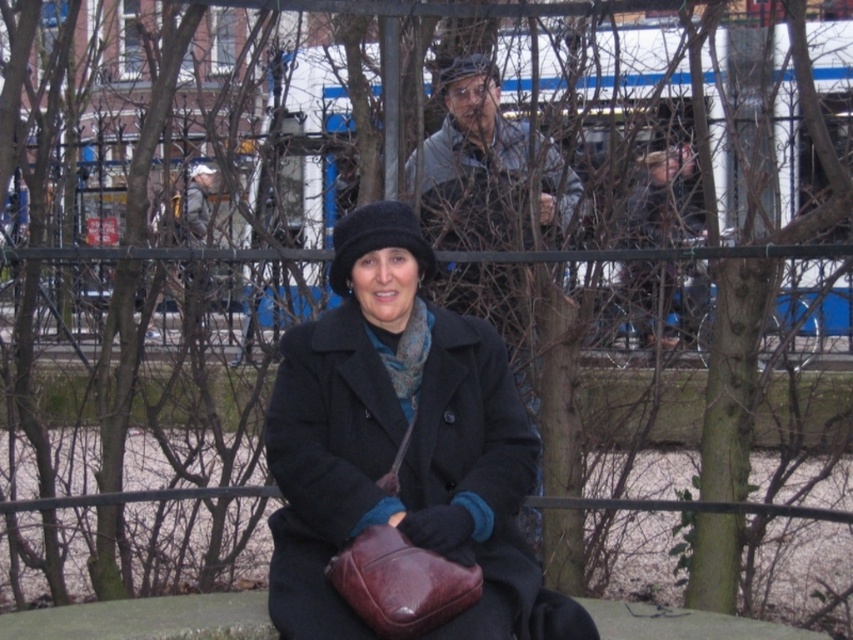
Can you confirm if matte black coat at center is thinner than gray woolen jacket at upper center?

No, matte black coat at center is not thinner than gray woolen jacket at upper center.

Does matte black coat at center appear under gray woolen jacket at upper center?

Yes, matte black coat at center is below gray woolen jacket at upper center.

What are the coordinates of `matte black coat at center` in the screenshot? It's located at (x=396, y=438).

Identify the location of matte black coat at center. (396, 438).